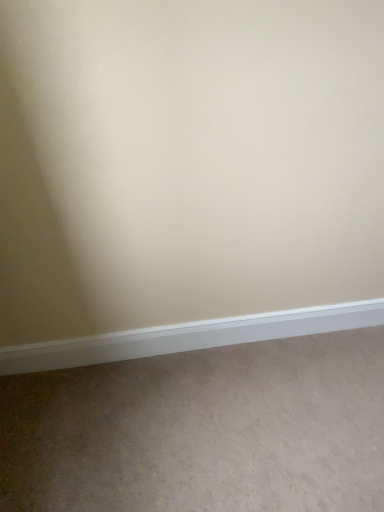
Question: Is white smooth baseboard at lower center directly adjacent to beige carpet at lower center?

Choices:
 (A) yes
 (B) no

Answer: (B)

Question: Is white smooth baseboard at lower center looking in the opposite direction of beige carpet at lower center?

Choices:
 (A) yes
 (B) no

Answer: (B)

Question: Is white smooth baseboard at lower center shorter than beige carpet at lower center?

Choices:
 (A) no
 (B) yes

Answer: (A)

Question: Is white smooth baseboard at lower center at the left side of beige carpet at lower center?

Choices:
 (A) no
 (B) yes

Answer: (B)

Question: From a real-world perspective, is white smooth baseboard at lower center located beneath beige carpet at lower center?

Choices:
 (A) yes
 (B) no

Answer: (B)

Question: Considering the relative sizes of white smooth baseboard at lower center and beige carpet at lower center in the image provided, is white smooth baseboard at lower center wider than beige carpet at lower center?

Choices:
 (A) no
 (B) yes

Answer: (A)

Question: From a real-world perspective, is beige carpet at lower center located higher than white smooth baseboard at lower center?

Choices:
 (A) yes
 (B) no

Answer: (B)

Question: Is white smooth baseboard at lower center surrounded by beige carpet at lower center?

Choices:
 (A) yes
 (B) no

Answer: (B)

Question: Does beige carpet at lower center have a lesser height compared to white smooth baseboard at lower center?

Choices:
 (A) no
 (B) yes

Answer: (B)

Question: Is beige carpet at lower center far from white smooth baseboard at lower center?

Choices:
 (A) yes
 (B) no

Answer: (B)

Question: Considering the relative sizes of beige carpet at lower center and white smooth baseboard at lower center in the image provided, is beige carpet at lower center bigger than white smooth baseboard at lower center?

Choices:
 (A) yes
 (B) no

Answer: (A)

Question: Considering the relative sizes of beige carpet at lower center and white smooth baseboard at lower center in the image provided, is beige carpet at lower center wider than white smooth baseboard at lower center?

Choices:
 (A) yes
 (B) no

Answer: (A)

Question: Considering the relative positions of beige carpet at lower center and white smooth baseboard at lower center in the image provided, is beige carpet at lower center to the left or to the right of white smooth baseboard at lower center?

Choices:
 (A) left
 (B) right

Answer: (B)